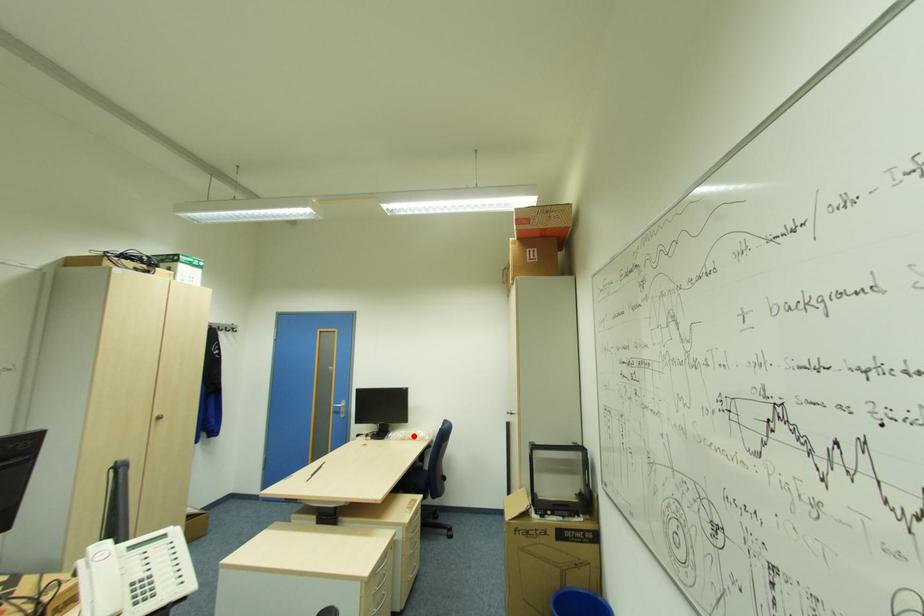
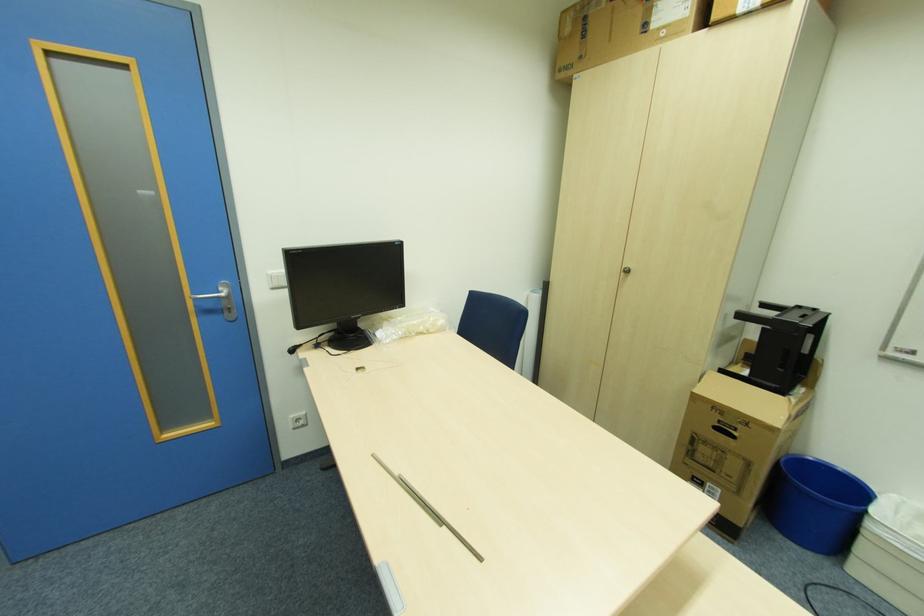
Question: A red point is marked in image1. In image2, is the corresponding 3D point closer to the camera or farther? Reply with the corresponding letter.

Choices:
 (A) The corresponding 3D point is closer.
 (B) The corresponding 3D point is farther.

Answer: (A)